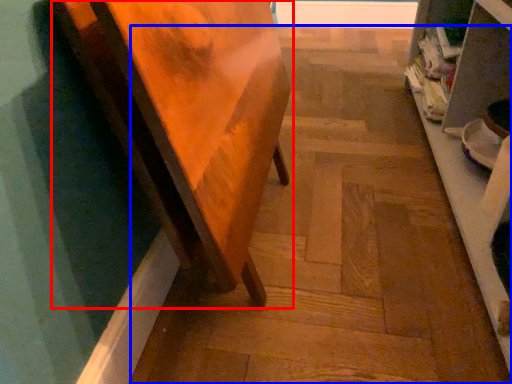
Question: Which object appears closest to the camera in this image, furniture (highlighted by a red box) or stair (highlighted by a blue box)?

Choices:
 (A) furniture
 (B) stair

Answer: (A)